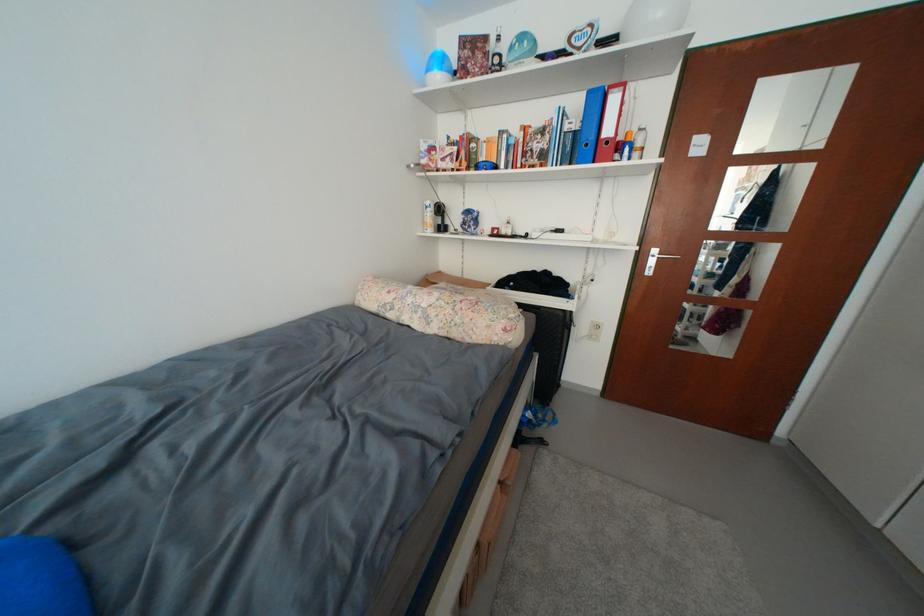
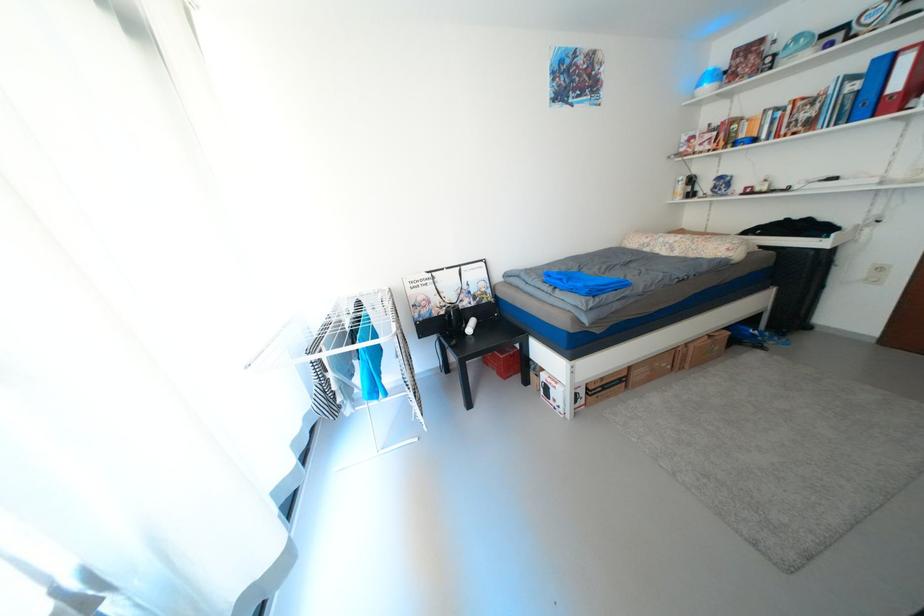
Locate, in the second image, the point that corresponds to point (508, 485) in the first image.

(718, 338)